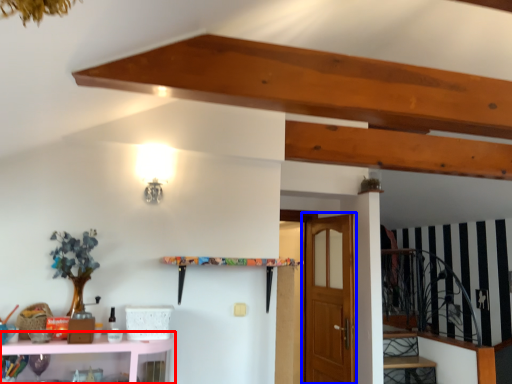
Question: Which point is further to the camera, shelf (highlighted by a red box) or door (highlighted by a blue box)?

Choices:
 (A) shelf
 (B) door

Answer: (B)